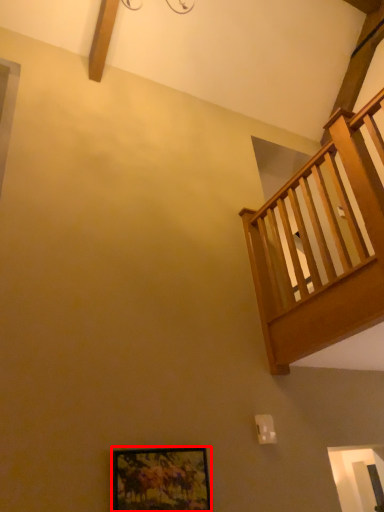
Question: From the image's perspective, where is picture frame (annotated by the red box) located relative to balcony?

Choices:
 (A) below
 (B) above

Answer: (A)